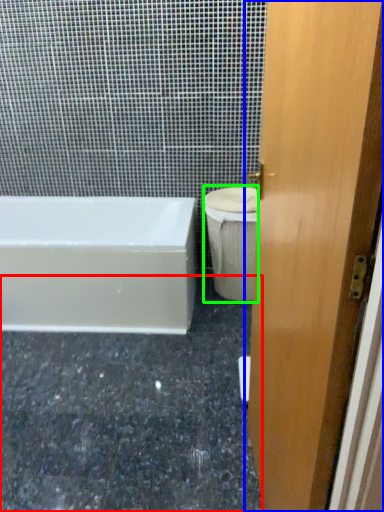
Question: Which object is positioned farthest from granite (highlighted by a red box)? Select from door (highlighted by a blue box) and toilet bowl (highlighted by a green box).

Choices:
 (A) door
 (B) toilet bowl

Answer: (A)